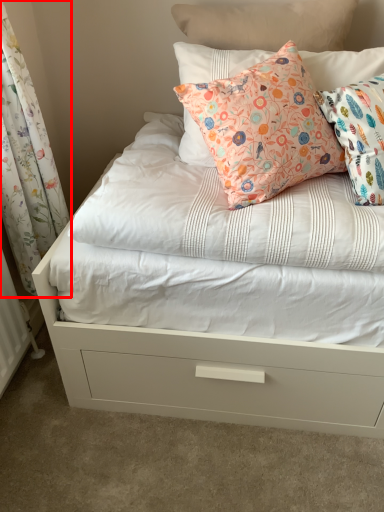
Question: Where is curtain (annotated by the red box) located in relation to pillow in the image?

Choices:
 (A) right
 (B) left

Answer: (B)